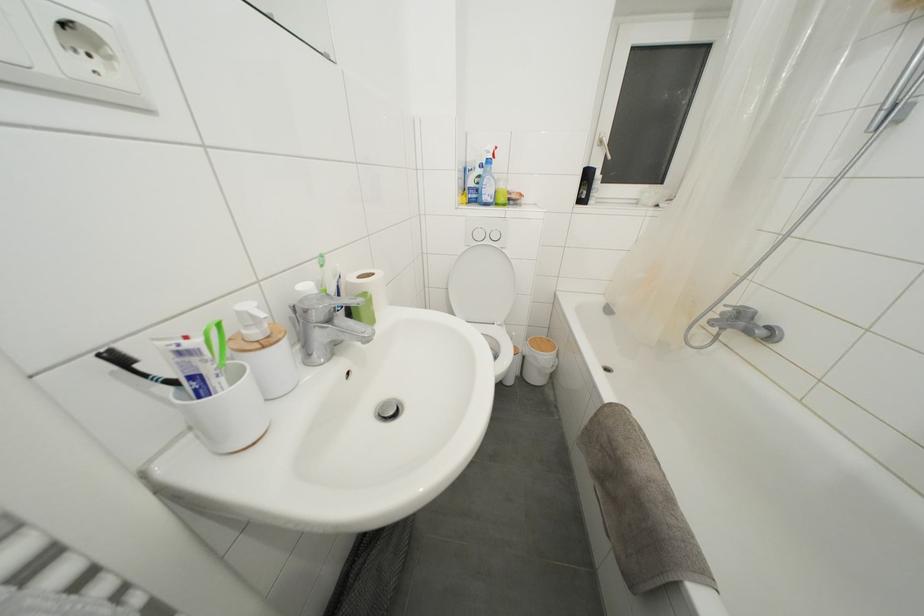
Image resolution: width=924 pixels, height=616 pixels. I want to click on toothpaste tube, so 189,363.